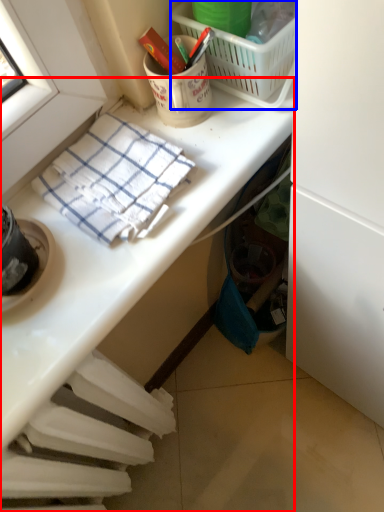
Question: Which of the following is the closest to the observer, desk (highlighted by a red box) or picnic basket (highlighted by a blue box)?

Choices:
 (A) desk
 (B) picnic basket

Answer: (A)